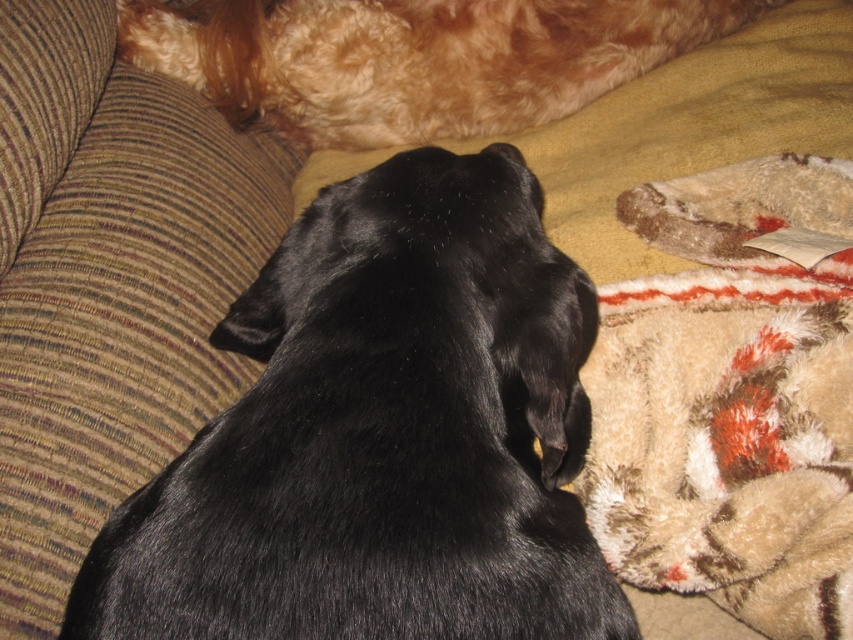
Question: Considering the relative positions of black fur dog at center and golden fur dog at upper center in the image provided, where is black fur dog at center located with respect to golden fur dog at upper center?

Choices:
 (A) below
 (B) above

Answer: (A)

Question: Which object is positioned farthest from the black fur dog at center?

Choices:
 (A) fuzzy beige blanket at lower right
 (B) golden fur dog at upper center

Answer: (B)

Question: Estimate the real-world distances between objects in this image. Which object is farther from the black fur dog at center?

Choices:
 (A) fuzzy beige blanket at lower right
 (B) golden fur dog at upper center

Answer: (B)

Question: Estimate the real-world distances between objects in this image. Which object is closer to the fuzzy beige blanket at lower right?

Choices:
 (A) golden fur dog at upper center
 (B) black fur dog at center

Answer: (B)

Question: Can you confirm if fuzzy beige blanket at lower right is bigger than golden fur dog at upper center?

Choices:
 (A) no
 (B) yes

Answer: (B)

Question: Is black fur dog at center closer to the viewer compared to golden fur dog at upper center?

Choices:
 (A) yes
 (B) no

Answer: (A)